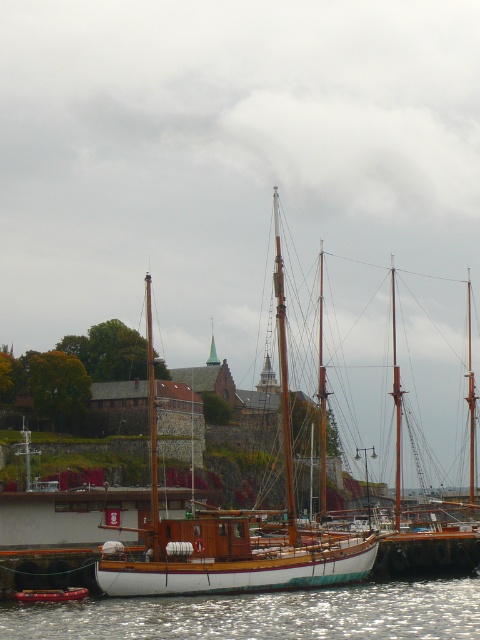
Question: Which of these objects is positioned farthest from the wooden boat at lower center?

Choices:
 (A) glistening water at lower left
 (B) wooden sailboat at center

Answer: (B)

Question: Does glistening water at lower left appear over wooden sailboat at center?

Choices:
 (A) no
 (B) yes

Answer: (A)

Question: Is glistening water at lower left bigger than wooden boat at lower center?

Choices:
 (A) yes
 (B) no

Answer: (A)

Question: Is glistening water at lower left bigger than wooden boat at lower center?

Choices:
 (A) yes
 (B) no

Answer: (A)

Question: Which point appears farthest from the camera in this image?

Choices:
 (A) tap(72, 604)
 (B) tap(175, 532)

Answer: (B)

Question: Which point appears farthest from the camera in this image?

Choices:
 (A) (80, 637)
 (B) (132, 556)
 (C) (84, 596)

Answer: (B)